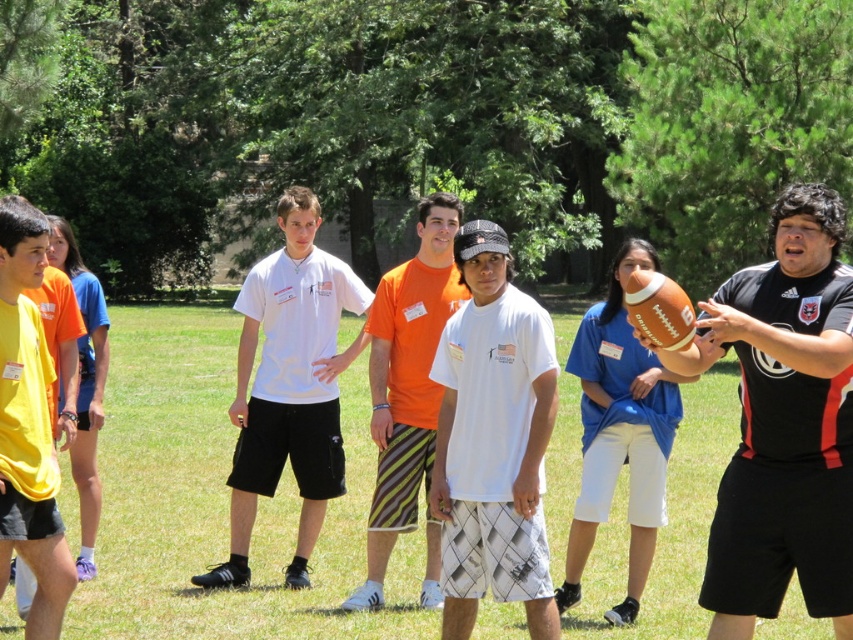
You are a photographer setting up for a group photo. You want to ensure that the white textured shirt at center and the orange striped shorts at center are both in focus. Given that your camera can only focus on objects within a 3.5 feet range, will both items be in focus?

The white textured shirt at center and orange striped shorts at center are 4.03 feet apart, which exceeds the camera focus range of 3.5 feet. Therefore, both items cannot be in focus simultaneously.